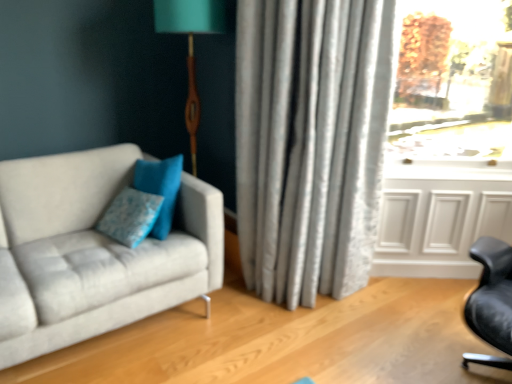
Question: Considering their positions, is blue fabric pillow at center located in front of or behind transparent glass window at upper right?

Choices:
 (A) front
 (B) behind

Answer: (A)

Question: Considering the relative positions of blue fabric pillow at center and transparent glass window at upper right in the image provided, is blue fabric pillow at center to the left or to the right of transparent glass window at upper right?

Choices:
 (A) right
 (B) left

Answer: (B)

Question: Which of these objects is positioned farthest from the suede gray couch at left?

Choices:
 (A) blue fabric pillow at center
 (B) transparent glass window at upper right
 (C) white paneling at lower right
 (D) silky gray curtain at center

Answer: (B)

Question: Which is farther from the transparent glass window at upper right?

Choices:
 (A) silky gray curtain at center
 (B) suede gray couch at left
 (C) white paneling at lower right
 (D) blue fabric pillow at center

Answer: (B)